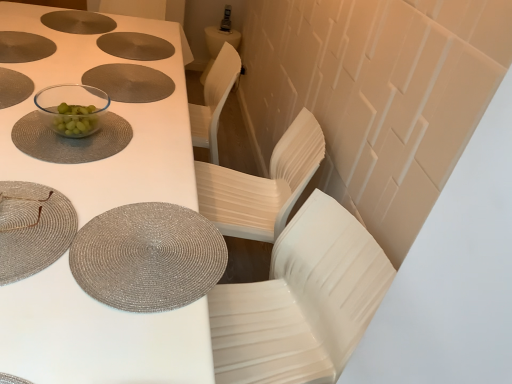
Question: In which direction should I rotate to look at transparent glass bowl at center, the third tableware when ordered from top to bottom?

Choices:
 (A) right
 (B) left

Answer: (B)

Question: Can you confirm if transparent glass bowl at center, placed as the fourth tableware when sorted from bottom to top, is wider than matte silver placemat at center?

Choices:
 (A) no
 (B) yes

Answer: (A)

Question: Is transparent glass bowl at center, placed as the fourth tableware when sorted from bottom to top, at the right side of matte silver placemat at center?

Choices:
 (A) no
 (B) yes

Answer: (A)

Question: From the image's perspective, is transparent glass bowl at center, the 2th tableware viewed from the top, on top of matte silver placemat at center?

Choices:
 (A) yes
 (B) no

Answer: (B)

Question: Does transparent glass bowl at center, positioned as the fourth tableware in front-to-back order, have a larger size compared to matte silver placemat at center?

Choices:
 (A) no
 (B) yes

Answer: (B)

Question: Is transparent glass bowl at center, placed as the fourth tableware when sorted from bottom to top, positioned beyond the bounds of matte silver placemat at center?

Choices:
 (A) yes
 (B) no

Answer: (A)

Question: From a real-world perspective, is silver woven placemat at lower left, positioned as the 5th tableware in back-to-front order, under matte silver placemat at center?

Choices:
 (A) yes
 (B) no

Answer: (B)

Question: From a real-world perspective, is silver woven placemat at lower left, which is the first tableware in front-to-back order, positioned over matte silver placemat at center based on gravity?

Choices:
 (A) yes
 (B) no

Answer: (A)

Question: Is silver woven placemat at lower left, acting as the fourth tableware starting from the top, bigger than matte silver placemat at center?

Choices:
 (A) yes
 (B) no

Answer: (A)

Question: From the image's perspective, does silver woven placemat at lower left, arranged as the 2th tableware when ordered from the bottom, appear lower than matte silver placemat at center?

Choices:
 (A) no
 (B) yes

Answer: (B)

Question: Is silver woven placemat at lower left, arranged as the 2th tableware when ordered from the bottom, smaller than matte silver placemat at center?

Choices:
 (A) yes
 (B) no

Answer: (B)

Question: Can you confirm if silver woven placemat at lower left, arranged as the 2th tableware when ordered from the bottom, is shorter than matte silver placemat at center?

Choices:
 (A) yes
 (B) no

Answer: (A)

Question: Considering the relative sizes of silver woven placemat at lower left, positioned as the 5th tableware in back-to-front order, and transparent glass bowl at center, the third tableware when ordered from top to bottom, in the image provided, is silver woven placemat at lower left, positioned as the 5th tableware in back-to-front order, taller than transparent glass bowl at center, the third tableware when ordered from top to bottom,?

Choices:
 (A) no
 (B) yes

Answer: (A)